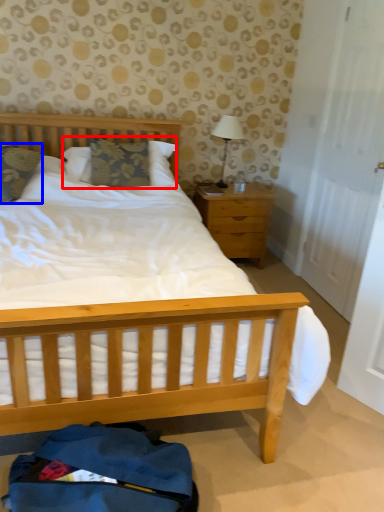
Question: Among these objects, which one is farthest to the camera, pillow (highlighted by a red box) or pillow (highlighted by a blue box)?

Choices:
 (A) pillow
 (B) pillow

Answer: (A)